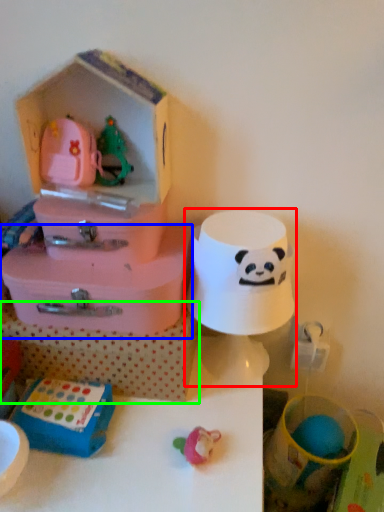
Question: Which object is positioned closest to toy (highlighted by a red box)? Select from storage box (highlighted by a blue box) and storage box (highlighted by a green box).

Choices:
 (A) storage box
 (B) storage box

Answer: (A)